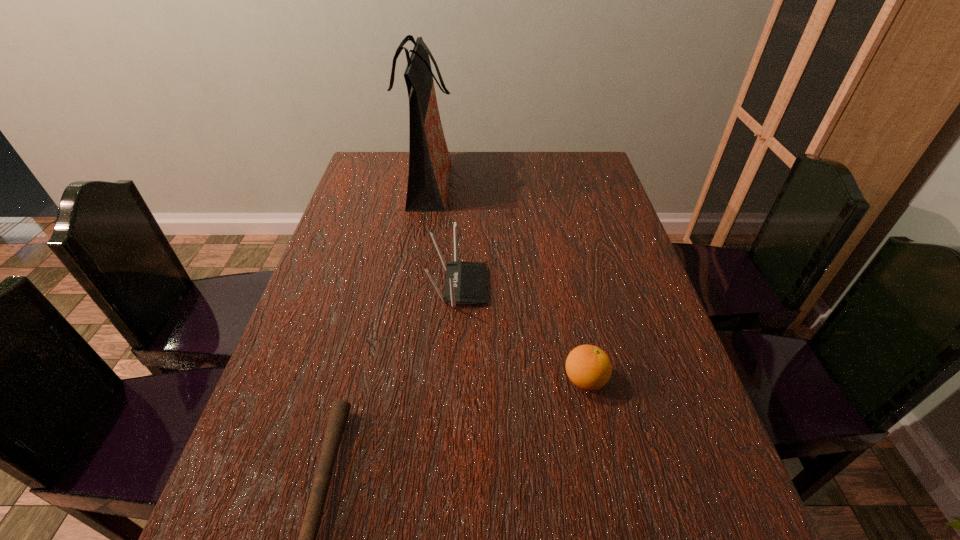
Identify the location of the tallest object. (429, 161).

Locate an element on the screen. Image resolution: width=960 pixels, height=540 pixels. shopping bag is located at coordinates (429, 161).

Find the location of a particular element. The height and width of the screenshot is (540, 960). the third nearest object is located at coordinates (466, 282).

I want to click on router, so click(x=466, y=282).

Identify the location of orange. The image size is (960, 540). (588, 367).

This screenshot has width=960, height=540. I want to click on the second shortest object, so click(x=588, y=367).

At what (x,y) coordinates should I click in order to perform the action: click on free space located on the front side of the shopping bag. Please return your answer as a coordinate pair (x, y). The width and height of the screenshot is (960, 540). Looking at the image, I should click on [x=507, y=187].

The width and height of the screenshot is (960, 540). I want to click on vacant region located 0.330m on the front-facing side of the second farthest object, so click(x=621, y=286).

The height and width of the screenshot is (540, 960). I want to click on free region located on the left of the orange, so click(454, 380).

Find the location of a particular element. This screenshot has width=960, height=540. object that is at the far edge is located at coordinates (429, 161).